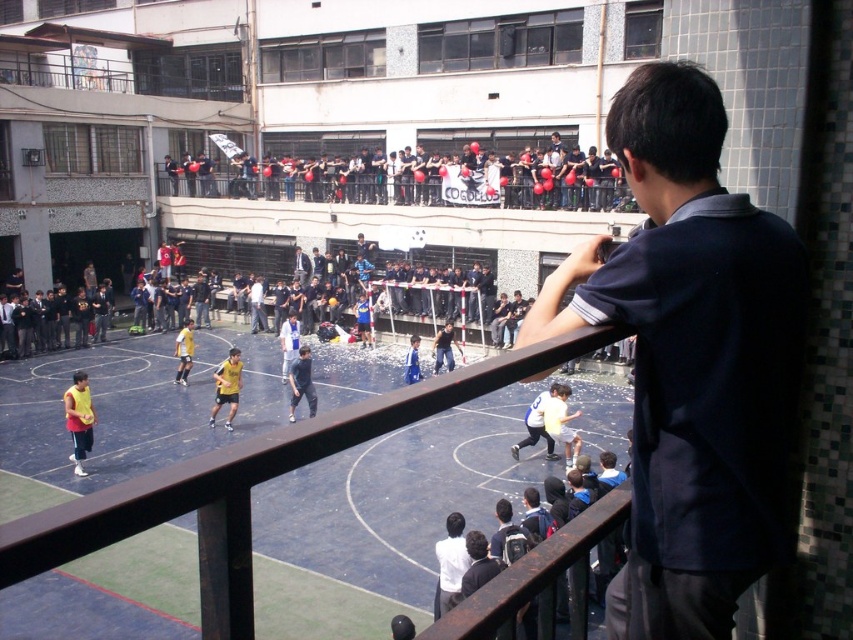
Does point (90, 540) lie behind point (451, 272)?

No, (90, 540) is closer to viewer.

Is blue rubber basketball court at center below dark blue jersey at center?

Correct, blue rubber basketball court at center is located below dark blue jersey at center.

Which is behind, point (84, 522) or point (428, 301)?

Point (428, 301)

Locate an element on the screen. Image resolution: width=853 pixels, height=640 pixels. blue rubber basketball court at center is located at coordinates (253, 483).

Looking at this image, does dark blue jersey at center have a greater height compared to yellow jersey at center?

Correct, dark blue jersey at center is much taller as yellow jersey at center.

Can you confirm if dark blue jersey at center is thinner than yellow jersey at center?

No.

The height and width of the screenshot is (640, 853). In order to click on dark blue jersey at center in this screenshot , I will do point(445,304).

Looking at this image, can you confirm if black fabric crowd at upper center is thinner than dark blue jersey at center?

No, black fabric crowd at upper center is not thinner than dark blue jersey at center.

In the scene shown: Who is positioned more to the right, black fabric crowd at upper center or dark blue jersey at center?

black fabric crowd at upper center

Is point (607, 150) positioned in front of point (193, 294)?

Yes, it is.

What are the coordinates of `black fabric crowd at upper center` in the screenshot? It's located at (416, 179).